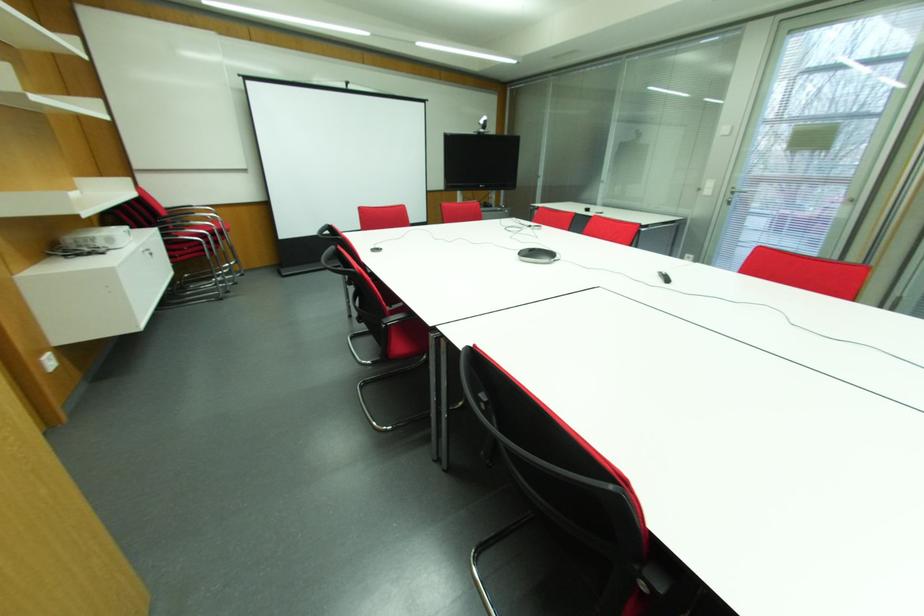
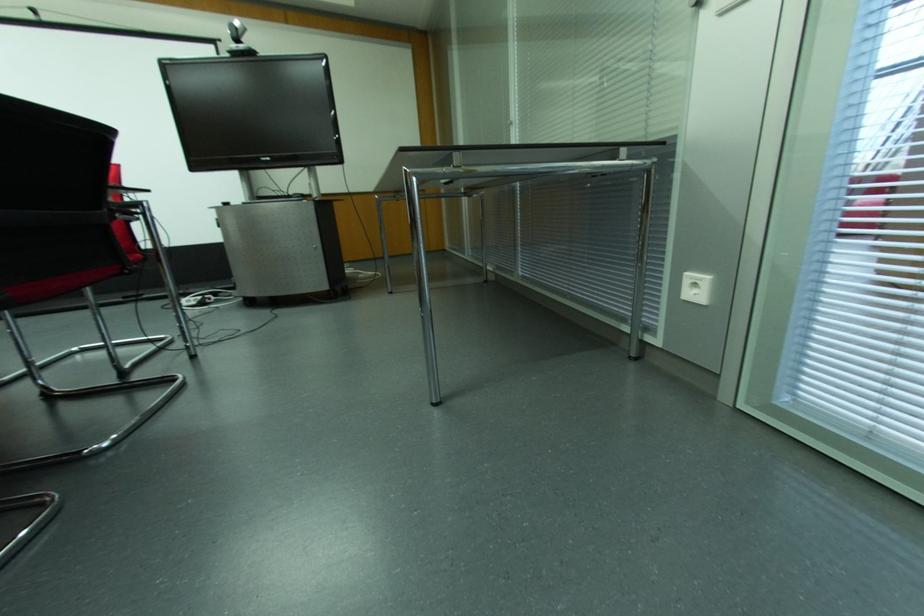
The point at (484,118) is marked in the first image. Where is the corresponding point in the second image?

(237, 23)